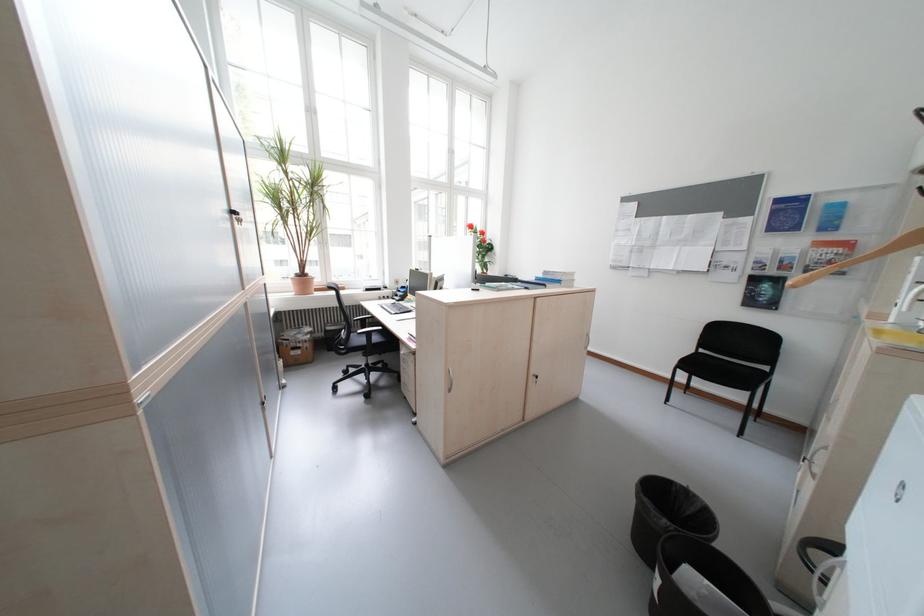
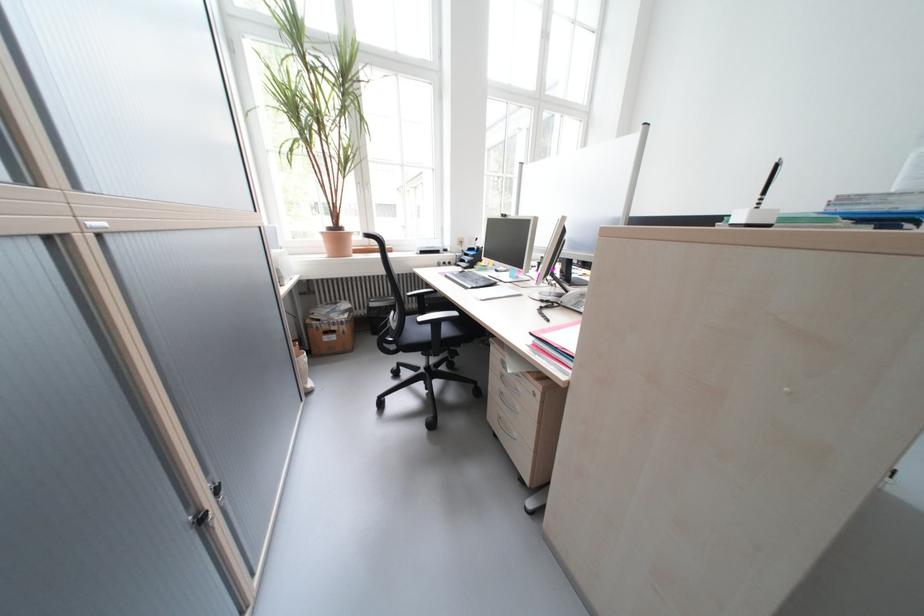
Find the pixel in the second image that matches (x=309, y=353) in the first image.

(344, 339)